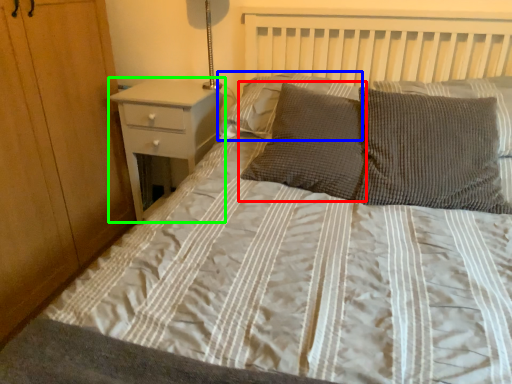
Question: Which object is positioned farthest from pillow (highlighted by a red box)? Select from pillow (highlighted by a blue box) and nightstand (highlighted by a green box).

Choices:
 (A) pillow
 (B) nightstand

Answer: (B)